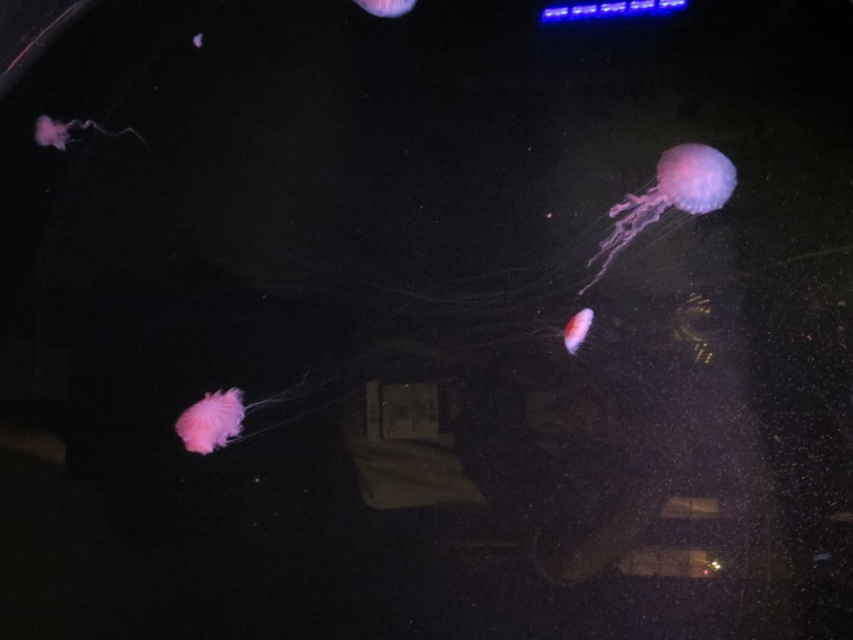
Does point (663, 179) come behind point (178, 419)?

No, it is in front of (178, 419).

Between point (676, 177) and point (213, 403), which one is positioned behind?

The point (213, 403) is behind.

Describe the element at coordinates (668, 196) in the screenshot. Image resolution: width=853 pixels, height=640 pixels. I see `translucent purple jellyfish at upper right` at that location.

Find the location of a particular element. translucent purple jellyfish at upper right is located at coordinates (668, 196).

Is translucent pink jellyfish at lower left to the right of translucent pink jellyfish at upper left from the viewer's perspective?

Yes, translucent pink jellyfish at lower left is to the right of translucent pink jellyfish at upper left.

Does translucent pink jellyfish at lower left have a lesser height compared to translucent pink jellyfish at upper left?

Incorrect, translucent pink jellyfish at lower left's height does not fall short of translucent pink jellyfish at upper left's.

Who is more forward, (219,403) or (51,138)?

Positioned in front is point (51,138).

The height and width of the screenshot is (640, 853). What are the coordinates of `translucent pink jellyfish at lower left` in the screenshot? It's located at (210, 420).

Can you confirm if translucent purple jellyfish at upper right is shorter than translucent pink jellyfish at upper left?

No, translucent purple jellyfish at upper right is not shorter than translucent pink jellyfish at upper left.

Does translucent purple jellyfish at upper right appear over translucent pink jellyfish at upper left?

No.

This screenshot has width=853, height=640. I want to click on translucent purple jellyfish at upper right, so click(x=668, y=196).